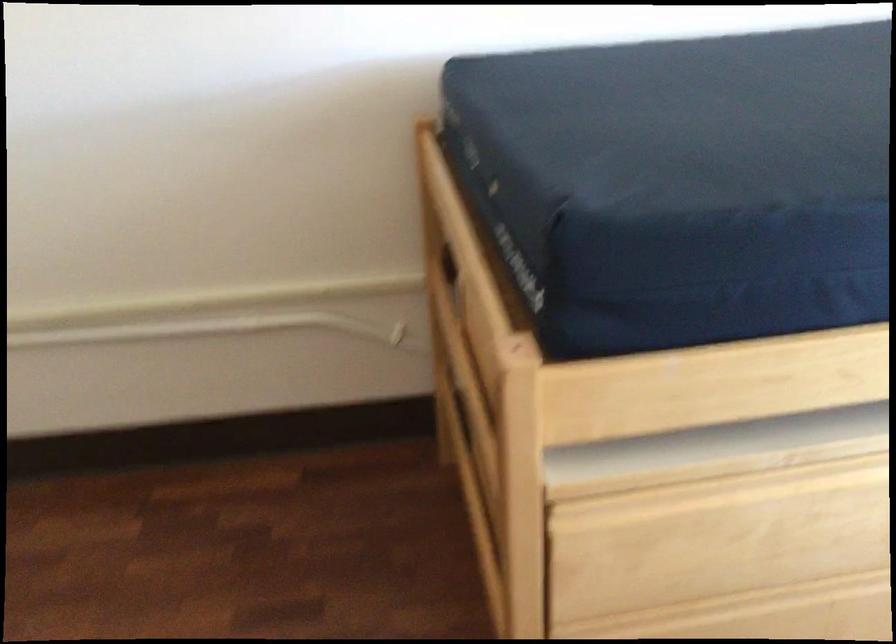
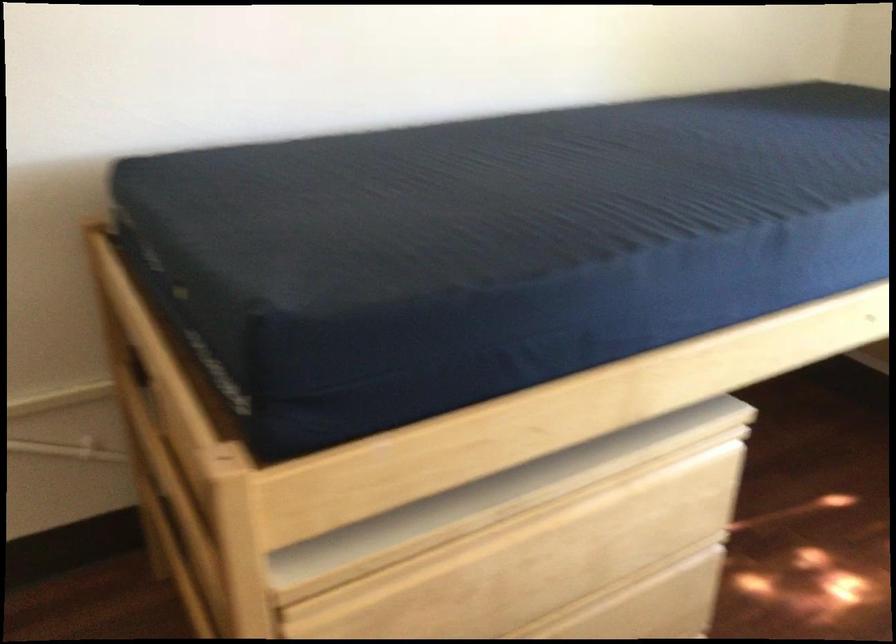
Find the pixel in the second image that matches pixel 641 465 in the first image.

(366, 554)